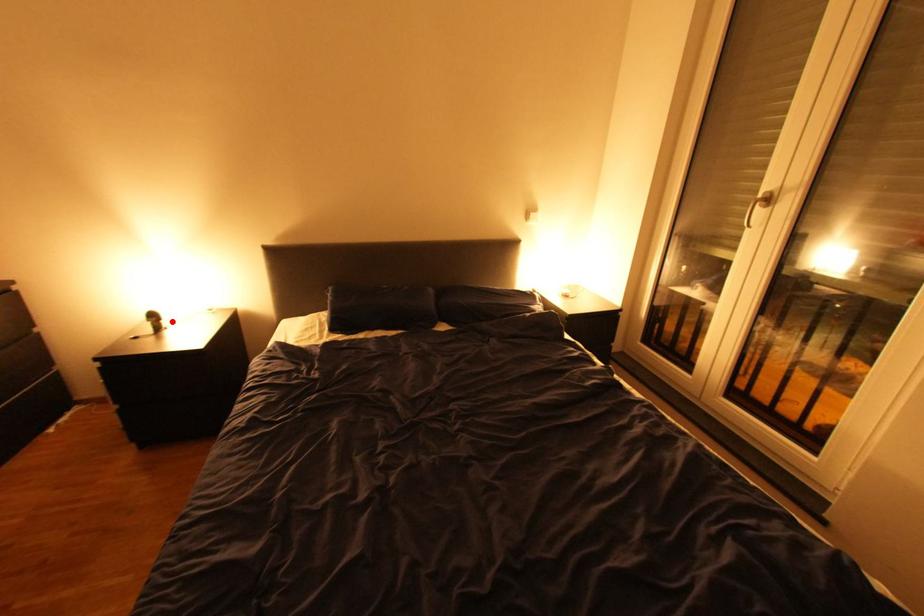
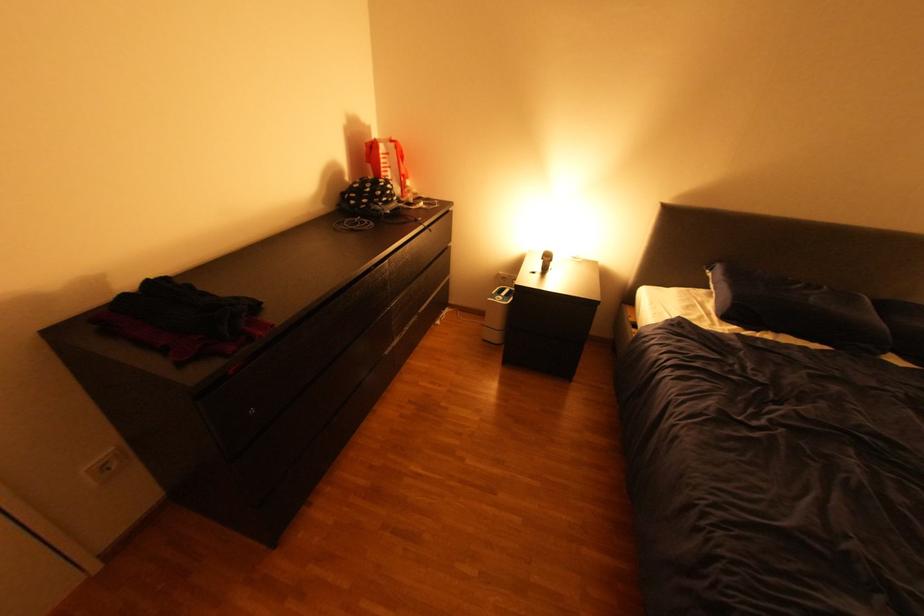
The point at the highlighted location is marked in the first image. Where is the corresponding point in the second image?

(561, 262)